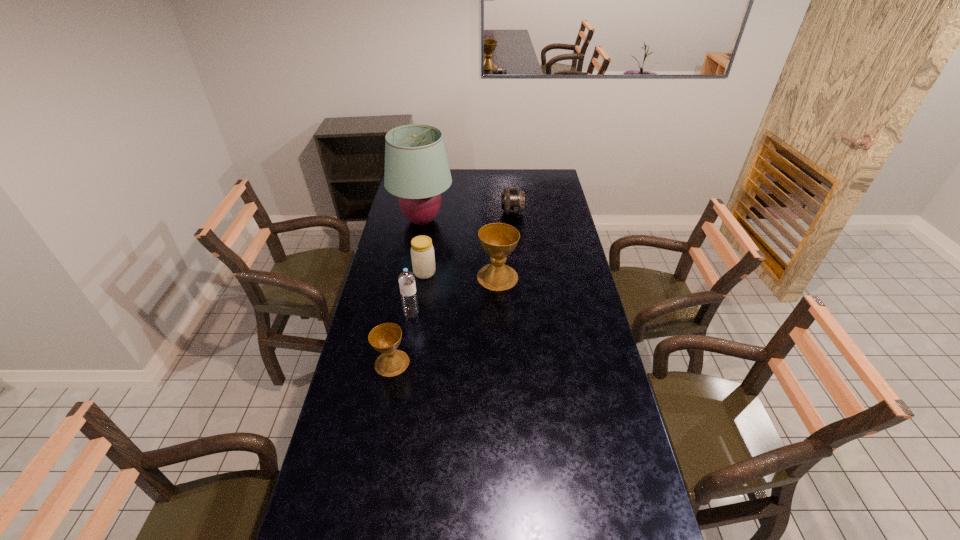
In the current image, all chalices are evenly spaced. To maintain this equal spacing, where should an additional chalice be placed on the right? Please point out a free spot. Please provide its 2D coordinates. Your answer should be formatted as a tuple, i.e. [(x, y)], where the tuple contains the x and y coordinates of a point satisfying the conditions above.

[(570, 218)]